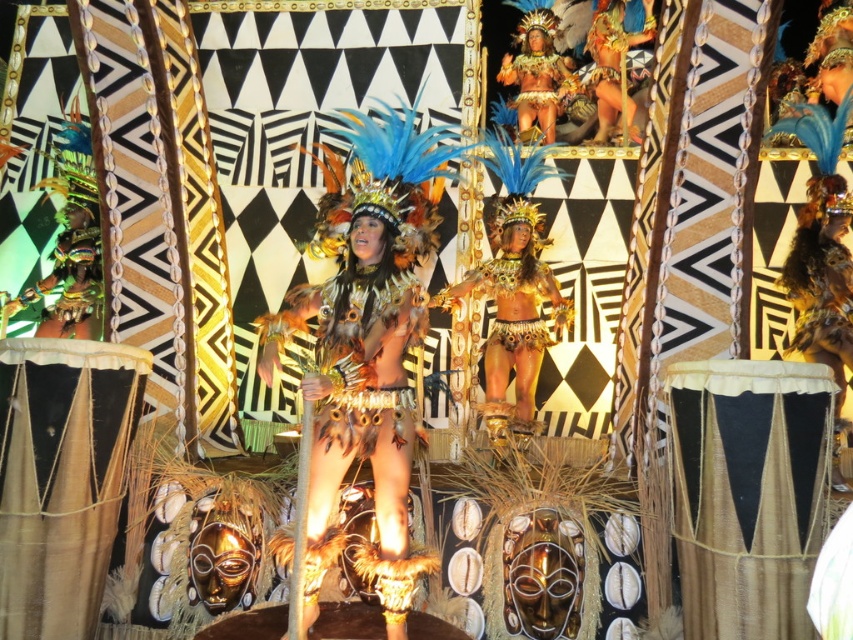
Is shiny gold costume at upper center above gold metallic headdress at upper center?

Correct, shiny gold costume at upper center is located above gold metallic headdress at upper center.

Is shiny gold costume at upper center wider than gold metallic headdress at upper center?

Yes, shiny gold costume at upper center is wider than gold metallic headdress at upper center.

Who is more distant from viewer, (637, 141) or (555, 93)?

The point (555, 93) is behind.

The height and width of the screenshot is (640, 853). I want to click on shiny gold costume at upper center, so click(x=614, y=61).

Who is positioned more to the left, feathered gold costume at center or gold metallic bikini at center?

Positioned to the left is feathered gold costume at center.

Can you confirm if feathered gold costume at center is taller than gold metallic bikini at center?

Indeed, feathered gold costume at center has a greater height compared to gold metallic bikini at center.

Which is behind, point (366, 394) or point (503, 262)?

Positioned behind is point (503, 262).

The width and height of the screenshot is (853, 640). Find the location of `feathered gold costume at center`. feathered gold costume at center is located at coordinates (358, 349).

Is gold metallic bikini at center behind gold metallic headdress at upper center?

No, it is in front of gold metallic headdress at upper center.

Between gold metallic bikini at center and gold metallic headdress at upper center, which one is positioned lower?

gold metallic bikini at center is lower down.

What are the coordinates of `gold metallic bikini at center` in the screenshot? It's located at (521, 301).

At what (x,y) coordinates should I click in order to perform the action: click on gold metallic bikini at center. Please return your answer as a coordinate pair (x, y). Looking at the image, I should click on (521, 301).